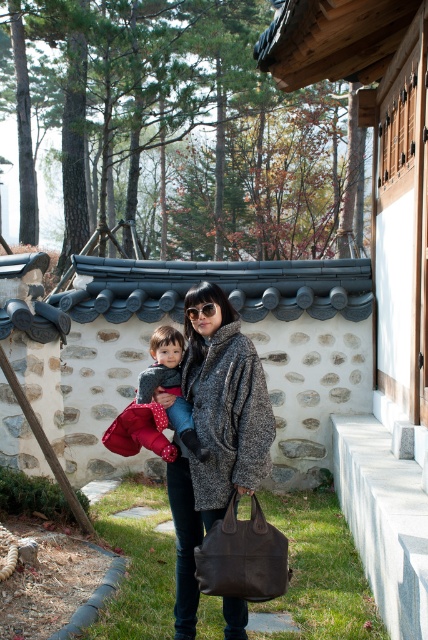
You are a photographer trying to capture a photo of the textured gray coat at center and the polka dot fabric baby at center. Which object should you focus on first if you want to ensure both are in focus?

The textured gray coat at center is positioned under the polka dot fabric baby at center, so you should focus on the polka dot fabric baby at center first to ensure both are in focus.